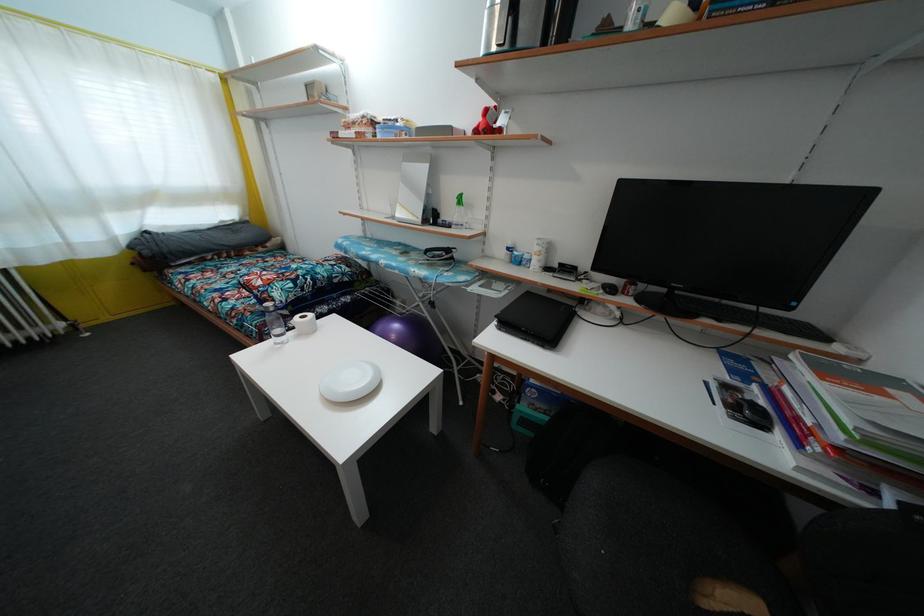
At what (x,y) coordinates should I click in order to perform the action: click on spray bottle trigger. Please return your answer as a coordinate pair (x, y). The image size is (924, 616). Looking at the image, I should click on (459, 205).